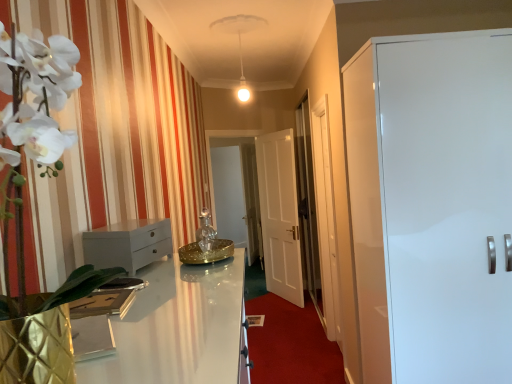
What is the approximate width of gold metallic tray at center?

It is 7.97 inches.

What is the approximate width of white glossy door at center, the 2th door from the front?

The width of white glossy door at center, the 2th door from the front, is 3.35 inches.

In order to face transparent glass door at center, the 1th glass door in the back-to-front sequence, should I rotate leftwards or rightwards?

A 2.987 degree turn to the left will do.

In order to face white glossy chest of drawers at left, should I rotate leftwards or rightwards?

It's best to rotate left around 15.992 degrees.

Where is `gold metallic tray at center`? Image resolution: width=512 pixels, height=384 pixels. gold metallic tray at center is located at coordinates (206, 245).

Is transparent glass door at center, the 2th glass door from the back, with white glossy chest of drawers at left?

No, transparent glass door at center, the 2th glass door from the back, is not with white glossy chest of drawers at left.

Does point (312, 149) come farther from viewer compared to point (121, 248)?

That is True.

Is transparent glass door at center, the 2th glass door from the back, facing away from white glossy chest of drawers at left?

No.

Are transparent glass door at center, the 2th glass door from the back, and white fabric curtain at left making contact?

They are not placed beside each other.

Is white fabric curtain at left a part of transparent glass door at center, the 1th glass door positioned from the front?

No, white fabric curtain at left is not inside transparent glass door at center, the 1th glass door positioned from the front.

Considering the sizes of transparent glass door at center, the 1th glass door positioned from the front, and white fabric curtain at left in the image, is transparent glass door at center, the 1th glass door positioned from the front, taller or shorter than white fabric curtain at left?

Considering their sizes, transparent glass door at center, the 1th glass door positioned from the front, has more height than white fabric curtain at left.

I want to click on chest of drawers on the left of white glossy cabinet at right, placed as the second door when sorted from back to front, so click(128, 244).

Is white glossy cabinet at right, which is counted as the 1th door, starting from the front, not close to white glossy chest of drawers at left?

Yes, white glossy cabinet at right, which is counted as the 1th door, starting from the front, and white glossy chest of drawers at left are quite far apart.

How far apart are white glossy cabinet at right, which is counted as the 1th door, starting from the front, and white glossy chest of drawers at left?

1.22 meters.

Which is more distant, (381, 97) or (119, 226)?

The point (381, 97) is farther from the camera.

Choose the correct answer: Is white fabric curtain at left inside gold metallic tray at center or outside it?

white fabric curtain at left is not inside gold metallic tray at center, it's outside.

Can you confirm if white fabric curtain at left is thinner than gold metallic tray at center?

No, white fabric curtain at left is not thinner than gold metallic tray at center.

From a real-world perspective, which object rests below the other?

gold metallic tray at center is physically lower.

Can you confirm if white fabric curtain at left is smaller than transparent glass door at center, positioned as the 1th glass door in right-to-left order?

Yes, white fabric curtain at left is smaller than transparent glass door at center, positioned as the 1th glass door in right-to-left order.

Is white fabric curtain at left touching transparent glass door at center, the 1th glass door positioned from the front?

No, white fabric curtain at left is not in contact with transparent glass door at center, the 1th glass door positioned from the front.

Is white fabric curtain at left facing towards transparent glass door at center, the 2th glass door from the back?

No.

From the image's perspective, relative to transparent glass door at center, the 2th glass door when ordered from left to right, is white fabric curtain at left above or below?

From the image's perspective, white fabric curtain at left appears above transparent glass door at center, the 2th glass door when ordered from left to right.

How many degrees apart are the facing directions of white glossy door at center, placed as the first door when sorted from left to right, and transparent glass door at center, positioned as the 1th glass door in right-to-left order?

34.1 degrees separate the facing orientations of white glossy door at center, placed as the first door when sorted from left to right, and transparent glass door at center, positioned as the 1th glass door in right-to-left order.

From a real-world perspective, is white glossy door at center, the 1th door viewed from the back, physically located above or below transparent glass door at center, the 1th glass door positioned from the front?

white glossy door at center, the 1th door viewed from the back, is situated lower than transparent glass door at center, the 1th glass door positioned from the front, in the real world.

Is white glossy door at center, arranged as the second door when viewed from the right, directly adjacent to transparent glass door at center, positioned as the 1th glass door in right-to-left order?

No, white glossy door at center, arranged as the second door when viewed from the right, is not with transparent glass door at center, positioned as the 1th glass door in right-to-left order.

Is white glossy door at center, arranged as the second door when viewed from the right, oriented towards transparent glass door at center, the 2th glass door from the back?

No, white glossy door at center, arranged as the second door when viewed from the right, is not aimed at transparent glass door at center, the 2th glass door from the back.

Between gold metallic tray at center and white fabric curtain at left, which one has larger size?

white fabric curtain at left is bigger.

From a real-world perspective, is gold metallic tray at center over white fabric curtain at left?

No, from a real-world perspective, gold metallic tray at center is not on top of white fabric curtain at left.

Considering the positions of objects gold metallic tray at center and white fabric curtain at left in the image provided, who is more to the left, gold metallic tray at center or white fabric curtain at left?

Positioned to the left is white fabric curtain at left.

Can white fabric curtain at left be found inside gold metallic tray at center?

No, gold metallic tray at center does not contain white fabric curtain at left.

At what (x,y) coordinates should I click in order to perform the action: click on the 2nd glass door counting from the right of the white glossy chest of drawers at left. Please return your answer as a coordinate pair (x, y). This screenshot has height=384, width=512. Looking at the image, I should click on (325, 218).

Where is `glass door that is the 2nd object located below the white fabric curtain at left (from the image's perspective)`? glass door that is the 2nd object located below the white fabric curtain at left (from the image's perspective) is located at coordinates (325, 218).

Looking at the image, which one is located further to white fabric curtain at left, white glossy cabinet at right, the 2th door in the left-to-right sequence, or gold metallic tray at center?

gold metallic tray at center is further to white fabric curtain at left.

Considering their positions, is transparent glass door at center, the second glass door viewed from the front, positioned closer to white glossy cabinet at right, the 2th door in the left-to-right sequence, than white glossy door at center, the 2th door from the front?

white glossy door at center, the 2th door from the front, is positioned closer to the anchor white glossy cabinet at right, the 2th door in the left-to-right sequence.

Looking at the image, which one is located closer to transparent glass door at center, positioned as the 1th glass door in right-to-left order, gold metallic tray at center or white glossy chest of drawers at left?

gold metallic tray at center is positioned closer to the anchor transparent glass door at center, positioned as the 1th glass door in right-to-left order.

Which object lies nearer to the anchor point transparent glass door at center, the 2th glass door when ordered from left to right, white glossy door at center, placed as the first door when sorted from left to right, or transparent glass door at center, the second glass door viewed from the front?

white glossy door at center, placed as the first door when sorted from left to right, is positioned closer to the anchor transparent glass door at center, the 2th glass door when ordered from left to right.

Looking at the image, which one is located closer to white fabric curtain at left, white glossy door at center, placed as the first door when sorted from left to right, or transparent glass door at center, positioned as the second glass door in right-to-left order?

white glossy door at center, placed as the first door when sorted from left to right.

Looking at this image, estimate the real-world distances between objects in this image. Which object is further from white glossy door at center, the 1th door viewed from the back, transparent glass door at center, the 2th glass door from the back, or gold metallic tray at center?

transparent glass door at center, the 2th glass door from the back, lies further to white glossy door at center, the 1th door viewed from the back, than the other object.

Based on their spatial positions, is white glossy cabinet at right, the first door from the right, or transparent glass door at center, the second glass door viewed from the front, closer to white glossy door at center, the 2th door from the front?

transparent glass door at center, the second glass door viewed from the front.

Based on their spatial positions, is gold metallic tray at center or white glossy door at center, arranged as the second door when viewed from the right, closer to transparent glass door at center, the 2th glass door from the back?

gold metallic tray at center is closer to transparent glass door at center, the 2th glass door from the back.

Identify the location of door located between gold metallic tray at center and transparent glass door at center, the 1th glass door positioned from the front, in the depth direction. (432, 205).

Where is `glass door located between gold metallic tray at center and transparent glass door at center, the 1th glass door in the back-to-front sequence, in the depth direction`? glass door located between gold metallic tray at center and transparent glass door at center, the 1th glass door in the back-to-front sequence, in the depth direction is located at coordinates (325, 218).

Identify the location of door between white glossy chest of drawers at left and white glossy door at center, arranged as the second door when viewed from the right, from front to back. The height and width of the screenshot is (384, 512). (432, 205).

Identify the location of sink between white glossy chest of drawers at left and transparent glass door at center, positioned as the second glass door in right-to-left order, from front to back. Image resolution: width=512 pixels, height=384 pixels. (206, 245).